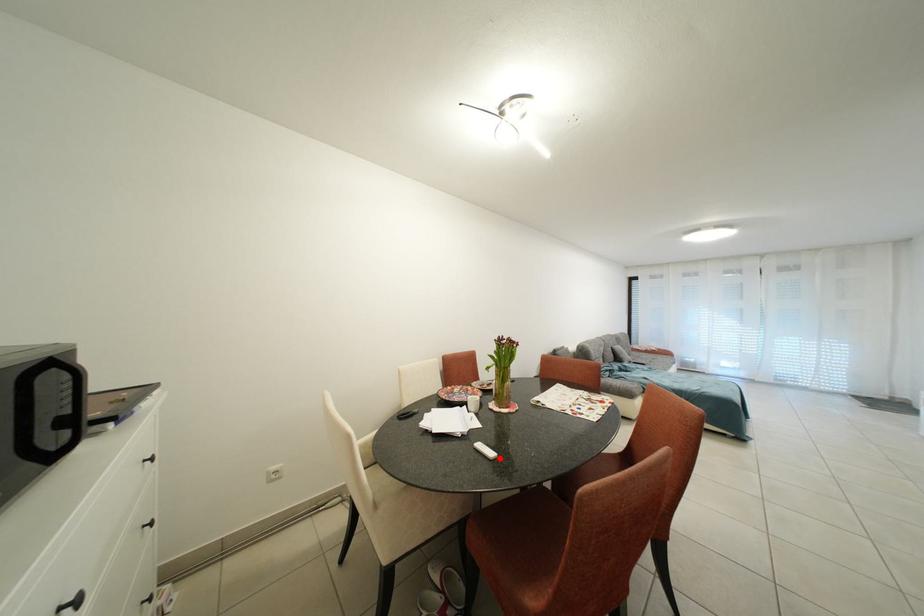
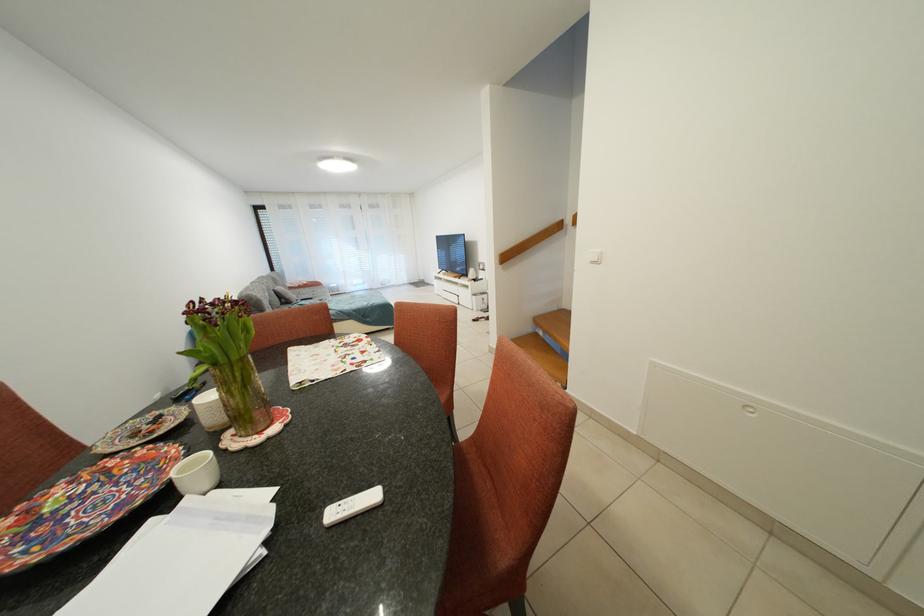
In the second image, find the point that corresponds to the highlighted location in the first image.

(382, 501)